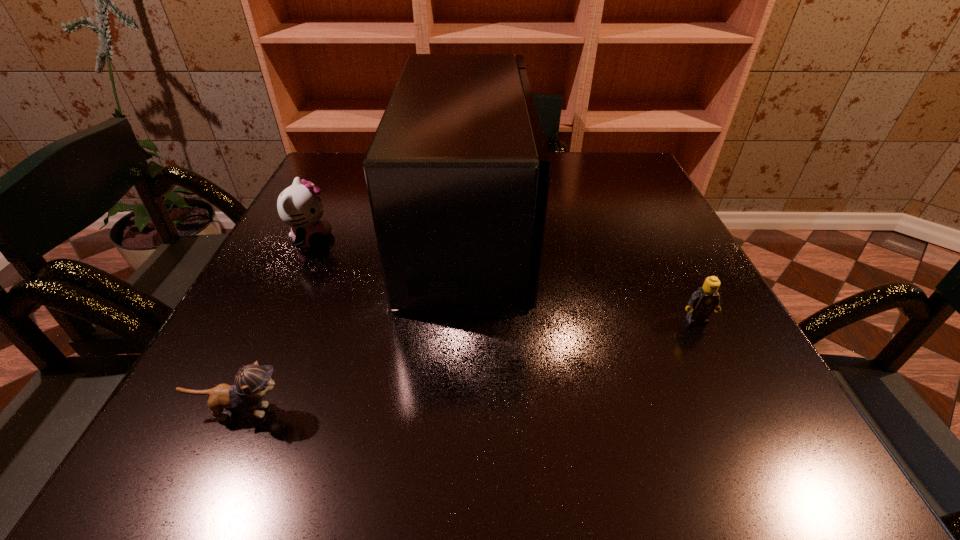
Locate an element on the screen. free space located 0.250m in front of the Lego is located at coordinates (770, 466).

Locate an element on the screen. This screenshot has height=540, width=960. object that is at the far edge is located at coordinates (458, 175).

Find the location of a particular element. object located at the near edge is located at coordinates (252, 382).

Where is `object present at the right edge`? Image resolution: width=960 pixels, height=540 pixels. object present at the right edge is located at coordinates (705, 300).

Image resolution: width=960 pixels, height=540 pixels. I want to click on object at the near left corner, so click(252, 382).

The width and height of the screenshot is (960, 540). Identify the location of free space at the left edge. (196, 406).

What are the coordinates of `vacant space at the right edge of the desktop` in the screenshot? It's located at (651, 202).

In order to click on vacant area at the far left corner of the desktop in this screenshot , I will do `click(347, 171)`.

The height and width of the screenshot is (540, 960). I want to click on vacant area between the tallest object and the Lego, so pyautogui.click(x=582, y=274).

Locate an element on the screen. empty space between the microwave_oven and the rightmost object is located at coordinates (582, 274).